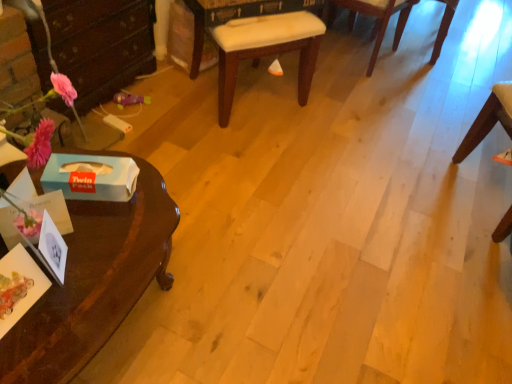
The width and height of the screenshot is (512, 384). I want to click on vacant space that is in between wooden chair at upper right, the third chair in the left-to-right sequence, and wooden chair at right, acting as the second chair starting from the right, so click(434, 91).